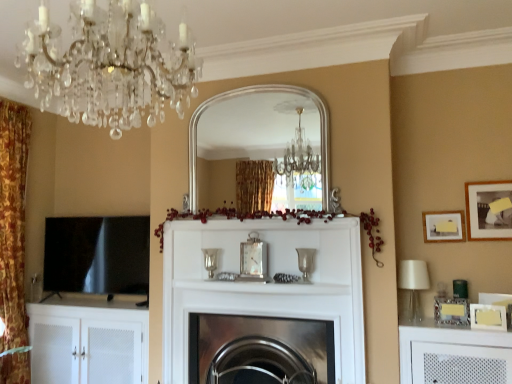
Question: Is silver/metallic mirror at center taller than crystal glass chandelier at upper left?

Choices:
 (A) yes
 (B) no

Answer: (A)

Question: Is crystal glass chandelier at upper left at the back of silver/metallic mirror at center?

Choices:
 (A) yes
 (B) no

Answer: (B)

Question: From a real-world perspective, is silver/metallic mirror at center located higher than crystal glass chandelier at upper left?

Choices:
 (A) yes
 (B) no

Answer: (B)

Question: Would you say silver/metallic mirror at center is outside crystal glass chandelier at upper left?

Choices:
 (A) no
 (B) yes

Answer: (B)

Question: Is the surface of silver/metallic mirror at center in direct contact with crystal glass chandelier at upper left?

Choices:
 (A) yes
 (B) no

Answer: (B)

Question: Visually, is black glossy tv at left positioned to the left or to the right of matte white picture frame at upper right, marked as the third picture frame in a bottom-to-top arrangement?

Choices:
 (A) left
 (B) right

Answer: (A)

Question: From a real-world perspective, is black glossy tv at left positioned above or below matte white picture frame at upper right, marked as the third picture frame in a bottom-to-top arrangement?

Choices:
 (A) below
 (B) above

Answer: (A)

Question: In terms of width, does black glossy tv at left look wider or thinner when compared to matte white picture frame at upper right, marked as the third picture frame in a bottom-to-top arrangement?

Choices:
 (A) thin
 (B) wide

Answer: (B)

Question: From the image's perspective, is black glossy tv at left located above or below matte white picture frame at upper right, marked as the third picture frame in a bottom-to-top arrangement?

Choices:
 (A) below
 (B) above

Answer: (A)

Question: In terms of width, does crystal glass chandelier at upper left look wider or thinner when compared to white matte picture frame at upper right, positioned as the 2th picture frame in bottom-to-top order?

Choices:
 (A) wide
 (B) thin

Answer: (A)

Question: Considering their positions, is crystal glass chandelier at upper left located in front of or behind white matte picture frame at upper right, positioned as the 2th picture frame in bottom-to-top order?

Choices:
 (A) front
 (B) behind

Answer: (A)

Question: From their relative heights in the image, would you say crystal glass chandelier at upper left is taller or shorter than white matte picture frame at upper right, positioned as the 2th picture frame in bottom-to-top order?

Choices:
 (A) short
 (B) tall

Answer: (B)

Question: Which is correct: crystal glass chandelier at upper left is inside white matte picture frame at upper right, which is counted as the 3th picture frame, starting from the top, or outside of it?

Choices:
 (A) outside
 (B) inside

Answer: (A)

Question: Looking at their shapes, would you say matte silver picture frame at upper right, the first picture frame positioned from the top, is wider or thinner than matte white picture frame at upper right, the 2th picture frame viewed from the top?

Choices:
 (A) thin
 (B) wide

Answer: (A)

Question: Considering the positions of point (471, 187) and point (439, 236), is point (471, 187) closer or farther from the camera than point (439, 236)?

Choices:
 (A) farther
 (B) closer

Answer: (B)